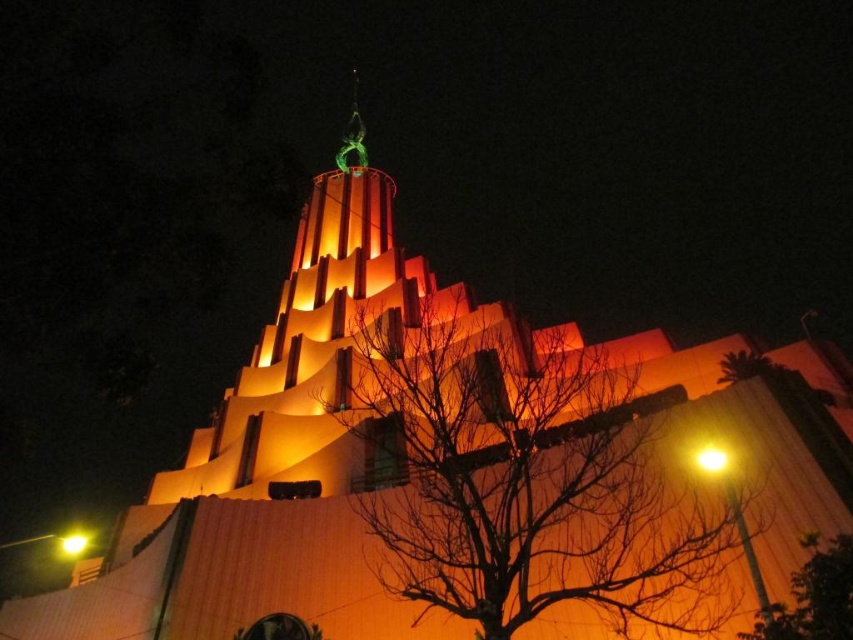
You are standing 50 meters away from a building. You see a point marked at coordinates point (567, 493). Is this point closer to you than your current position?

The distance of point (567, 493) from viewer is 53.06 meters, so the point is farther away than your current position of 50 meters.

You are standing in front of the building and want to take a photo that includes both the green leafy tree at lower right and the yellow matte light at upper right. Which object will appear bigger in the photo?

The green leafy tree at lower right will appear bigger in the photo because it has a larger size compared to the yellow matte light at upper right.

You are standing in front of the building and notice the green leafy tree at lower right and the yellow matte light at upper right. Which object is positioned more to the east if the building faces north?

The green leafy tree at lower right is to the right of the yellow matte light at upper right. Since the building faces north, the right side would correspond to the east direction. Therefore, the green leafy tree at lower right is positioned more to the east.